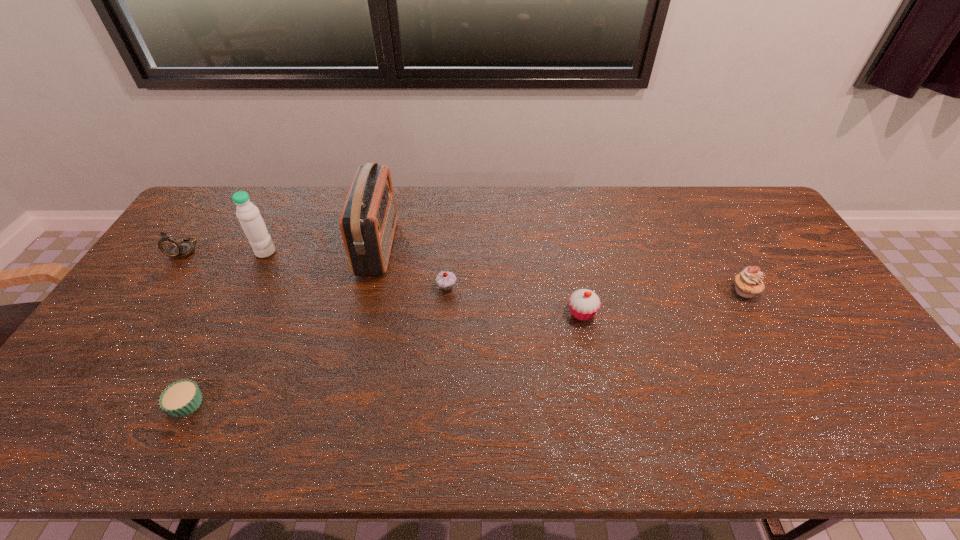
Locate an element on the screen. This screenshot has width=960, height=540. vacant space that is in between the third cupcake from right to left and the fourth object from left to right is located at coordinates (412, 267).

Identify the location of free area in between the shortest object and the rightmost cupcake. The image size is (960, 540). (466, 347).

Select which object is the fifth closest to the third cupcake from right to left. Please provide its 2D coordinates. Your answer should be formatted as a tuple, i.e. [(x, y)], where the tuple contains the x and y coordinates of a point satisfying the conditions above.

[(170, 246)]

Point out which object is positioned as the sixth nearest to the rightmost cupcake. Please provide its 2D coordinates. Your answer should be formatted as a tuple, i.e. [(x, y)], where the tuple contains the x and y coordinates of a point satisfying the conditions above.

[(170, 246)]

You are a GUI agent. You are given a task and a screenshot of the screen. Output one action in this format:
    pyautogui.click(x=<x>, y=<y>)
    Task: Click on the cupcake that stands as the closest to the water bottle
    
    Given the screenshot: What is the action you would take?
    pyautogui.click(x=183, y=397)

At what (x,y) coordinates should I click in order to perform the action: click on the closest cupcake relative to the leftmost cupcake. Please return your answer as a coordinate pair (x, y). The image size is (960, 540). Looking at the image, I should click on point(445,280).

Find the location of a particular element. This screenshot has height=540, width=960. free location that satisfies the following two spatial constraints: 1. on the front-facing side of the fourth object from right to left; 2. on the left side of the second cupcake from right to left is located at coordinates (362, 313).

Find the location of a particular element. The height and width of the screenshot is (540, 960). free location that satisfies the following two spatial constraints: 1. on the back side of the second tallest object; 2. on the right side of the leftmost cupcake is located at coordinates (263, 252).

Identify the location of free space that satisfies the following two spatial constraints: 1. on the front-facing side of the second cupcake from left to right; 2. on the left side of the fourth object from right to left. (369, 287).

This screenshot has height=540, width=960. I want to click on free space that satisfies the following two spatial constraints: 1. on the front-facing side of the fifth object from left to right; 2. on the left side of the radio receiver, so click(369, 287).